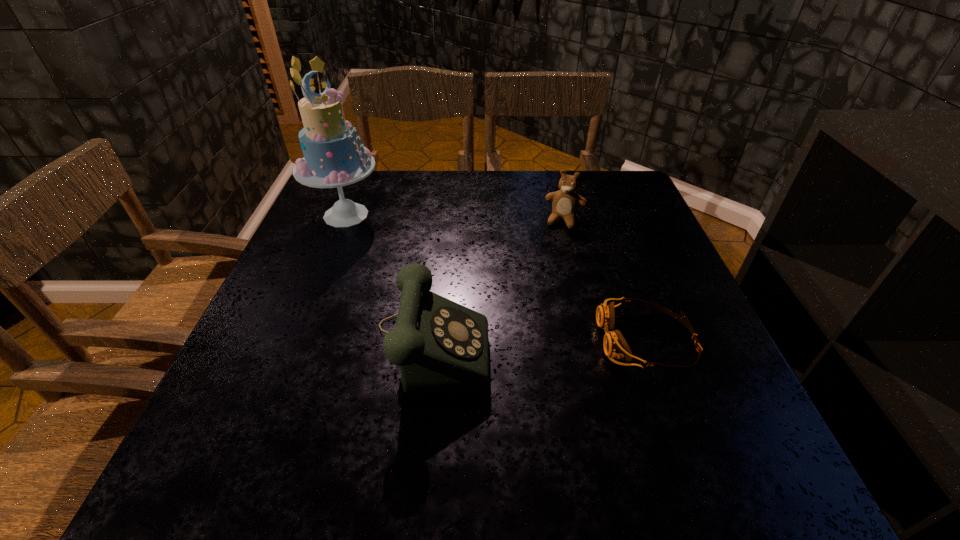
At what (x,y) coordinates should I click in order to perform the action: click on free spot that satisfies the following two spatial constraints: 1. on the front side of the shortest object; 2. with the lenses facing forward on the teddy bear. Please return your answer as a coordinate pair (x, y). This screenshot has height=540, width=960. Looking at the image, I should click on (595, 340).

I want to click on free spot that satisfies the following two spatial constraints: 1. on the front side of the shortest object; 2. with the lenses facing forward on the cake, so click(x=296, y=340).